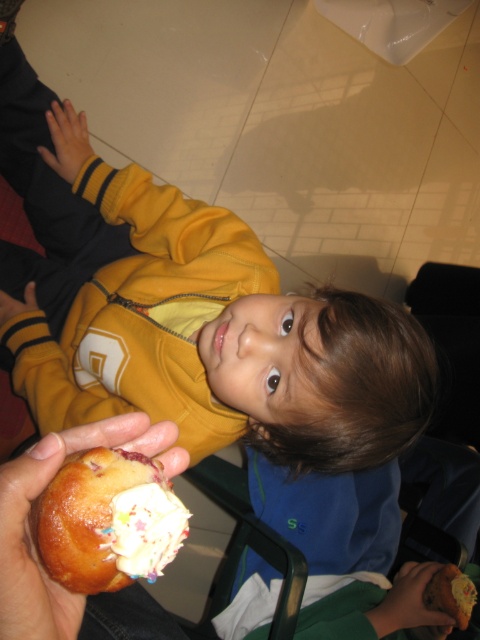
Does white glossy frosting at lower center have a lesser height compared to dark brown leather hand at lower right?

Yes.

Which is below, white glossy frosting at lower center or dark brown leather hand at lower right?

dark brown leather hand at lower right

This screenshot has height=640, width=480. What do you see at coordinates (145, 529) in the screenshot?
I see `white glossy frosting at lower center` at bounding box center [145, 529].

Where is `white glossy frosting at lower center`? white glossy frosting at lower center is located at coordinates (145, 529).

Identify the location of glazed doughnut at lower left. (108, 520).

Can you confirm if glazed doughnut at lower left is wider than white glossy frosting at lower center?

Yes.

Measure the distance between glazed doughnut at lower left and camera.

glazed doughnut at lower left and camera are 10.74 inches apart.

The image size is (480, 640). I want to click on glazed doughnut at lower left, so click(108, 520).

Is glazed doughnut at lower left shorter than dark brown leather hand at lower right?

Yes.

Is point (152, 525) closer to viewer compared to point (399, 608)?

Yes, it is.

Image resolution: width=480 pixels, height=640 pixels. What do you see at coordinates (108, 520) in the screenshot?
I see `glazed doughnut at lower left` at bounding box center [108, 520].

This screenshot has height=640, width=480. I want to click on glazed doughnut at lower left, so click(108, 520).